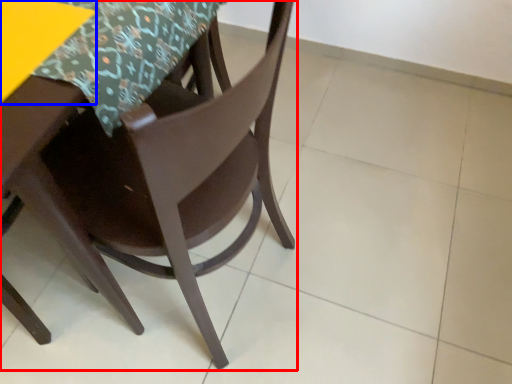
Question: Which object appears farthest to the camera in this image, chair (highlighted by a red box) or table (highlighted by a blue box)?

Choices:
 (A) chair
 (B) table

Answer: (B)